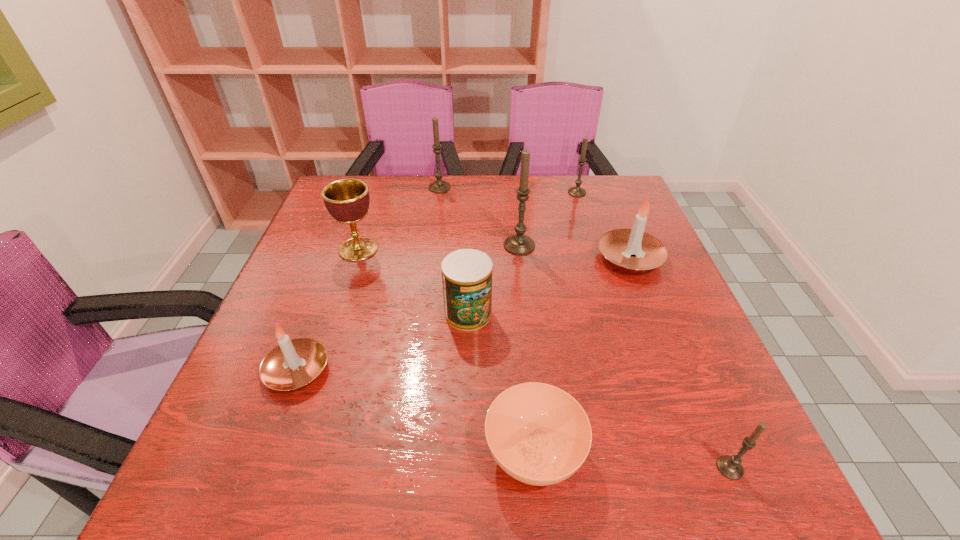
Image resolution: width=960 pixels, height=540 pixels. What are the coordinates of `free space at the far edge of the desktop` in the screenshot? It's located at (399, 206).

The width and height of the screenshot is (960, 540). In the image, there is a desktop. Identify the location of vacant space at the near edge. (297, 482).

The width and height of the screenshot is (960, 540). Identify the location of vacant area at the left edge. (255, 358).

Where is `free location at the right edge of the desktop`? The image size is (960, 540). free location at the right edge of the desktop is located at coordinates (634, 315).

Where is `free region at the far left corner of the desktop`? free region at the far left corner of the desktop is located at coordinates (330, 183).

I want to click on free space at the far right corner of the desktop, so click(x=600, y=210).

The height and width of the screenshot is (540, 960). Identify the location of vacant point located between the second smallest gray candle and the farther white candle. (604, 225).

Find the location of a particular element. The width and height of the screenshot is (960, 540). free spot between the biggest gray candle and the chalice is located at coordinates (439, 247).

Identify the location of free space between the shortest object and the third biggest gray candle. (556, 322).

The height and width of the screenshot is (540, 960). Identify the location of free space between the second candle from left to right and the can. (454, 251).